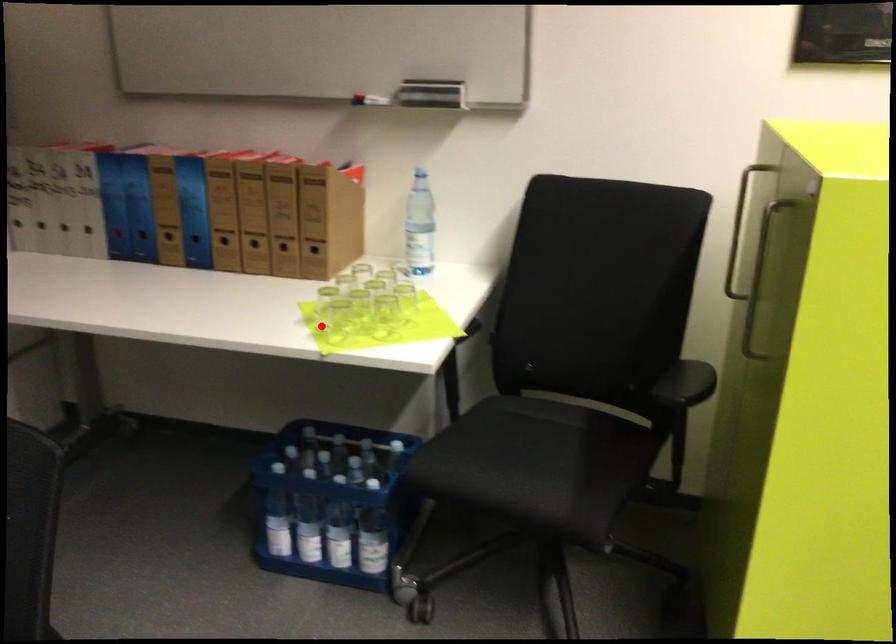
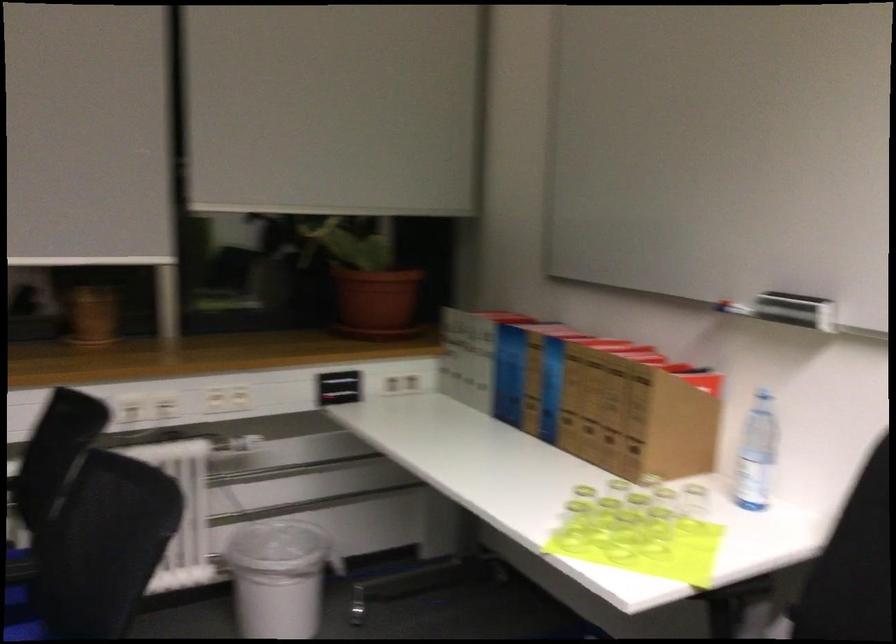
Locate, in the second image, the point that corresponds to the highlighted location in the first image.

(573, 526)